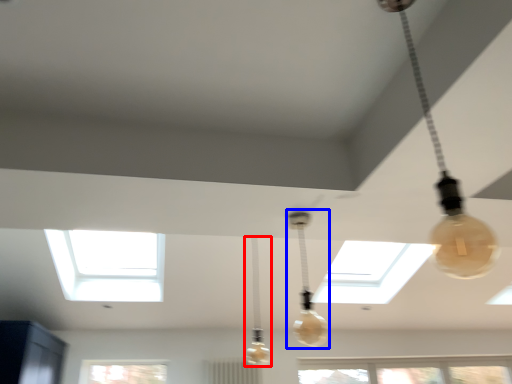
Question: Which object appears farthest to the camera in this image, lamp (highlighted by a red box) or lamp (highlighted by a blue box)?

Choices:
 (A) lamp
 (B) lamp

Answer: (A)